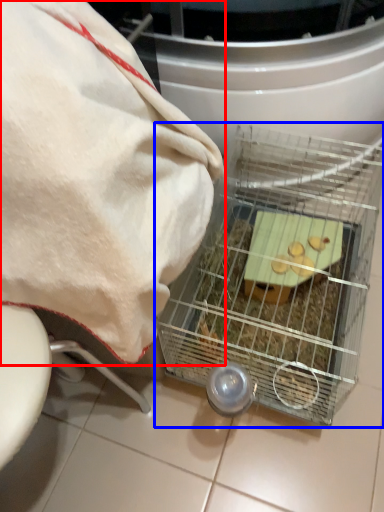
Question: Among these objects, which one is nearest to the camera, towel (highlighted by a red box) or appliance (highlighted by a blue box)?

Choices:
 (A) towel
 (B) appliance

Answer: (A)